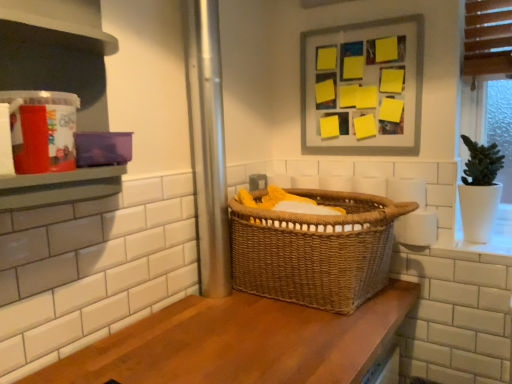
Where is `free point above wooden counter at center (from a real-world perspective)`? The width and height of the screenshot is (512, 384). free point above wooden counter at center (from a real-world perspective) is located at coordinates (246, 332).